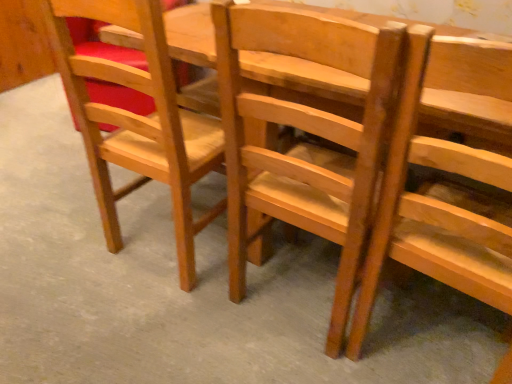
The width and height of the screenshot is (512, 384). What are the coordinates of `vacant region to the left of light brown wood chair at center, the 2th chair in the left-to-right sequence` in the screenshot? It's located at (178, 321).